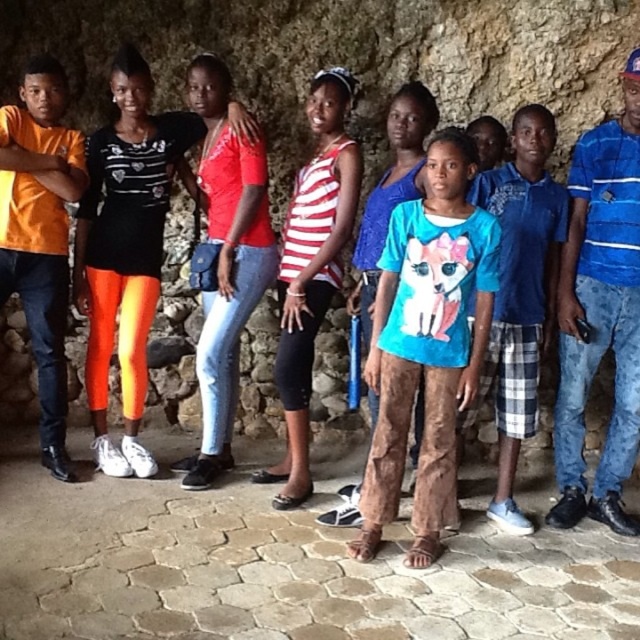
Does blue cotton shirt at center have a lesser height compared to neon orange leggings at center?

Yes, blue cotton shirt at center is shorter than neon orange leggings at center.

Which is in front, point (468, 330) or point (132, 186)?

Point (468, 330) is in front.

Find the location of `blue cotton shirt at center`. blue cotton shirt at center is located at coordinates (428, 344).

What are the coordinates of `blue cotton shirt at center` in the screenshot? It's located at (428, 344).

The width and height of the screenshot is (640, 640). What do you see at coordinates (125, 248) in the screenshot? I see `neon orange leggings at center` at bounding box center [125, 248].

Looking at this image, does neon orange leggings at center have a larger size compared to striped fabric tank top at center?

No, neon orange leggings at center is not bigger than striped fabric tank top at center.

Identify the location of neon orange leggings at center. Image resolution: width=640 pixels, height=640 pixels. (125, 248).

This screenshot has width=640, height=640. I want to click on neon orange leggings at center, so click(x=125, y=248).

Is blue cotton shirt at center wider than blue plaid shorts at center?

Indeed, blue cotton shirt at center has a greater width compared to blue plaid shorts at center.

How distant is blue cotton shirt at center from blue plaid shorts at center?

16.54 inches

This screenshot has height=640, width=640. Find the location of `blue cotton shirt at center`. blue cotton shirt at center is located at coordinates (428, 344).